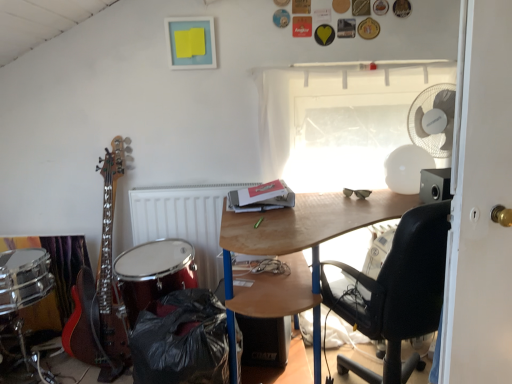
I want to click on free point to the right of hardcover book at center, so click(318, 201).